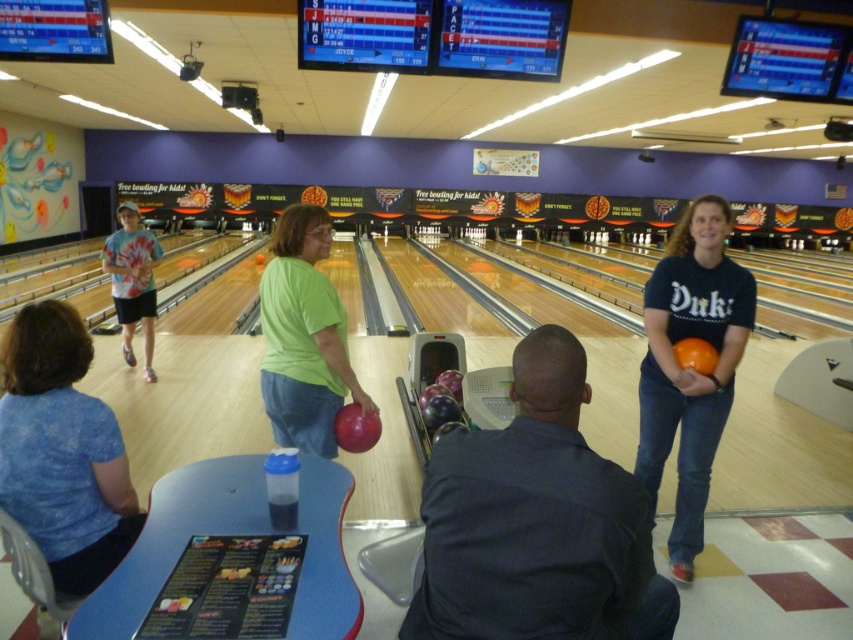
Who is taller, dark blue shirt at center or orange matte bowling ball at right?

With more height is orange matte bowling ball at right.

Between dark blue shirt at center and orange matte bowling ball at right, which one is positioned higher?

Positioned higher is orange matte bowling ball at right.

What do you see at coordinates (537, 522) in the screenshot? I see `dark blue shirt at center` at bounding box center [537, 522].

Where is `dark blue shirt at center`? dark blue shirt at center is located at coordinates (537, 522).

Is orange matte bowling ball at right wider than green matte bowling ball at center?

Correct, the width of orange matte bowling ball at right exceeds that of green matte bowling ball at center.

Based on the photo, can you confirm if orange matte bowling ball at right is positioned to the right of green matte bowling ball at center?

Yes, orange matte bowling ball at right is to the right of green matte bowling ball at center.

Which is in front, point (691, 266) or point (328, 413)?

Point (328, 413)

The width and height of the screenshot is (853, 640). I want to click on orange matte bowling ball at right, so click(689, 369).

Image resolution: width=853 pixels, height=640 pixels. I want to click on blue fabric shirt at lower left, so click(62, 451).

Does blue fabric shirt at lower left appear over tie-dye fabric shirt at left?

No.

Image resolution: width=853 pixels, height=640 pixels. What do you see at coordinates (62, 451) in the screenshot?
I see `blue fabric shirt at lower left` at bounding box center [62, 451].

This screenshot has width=853, height=640. I want to click on blue fabric shirt at lower left, so click(62, 451).